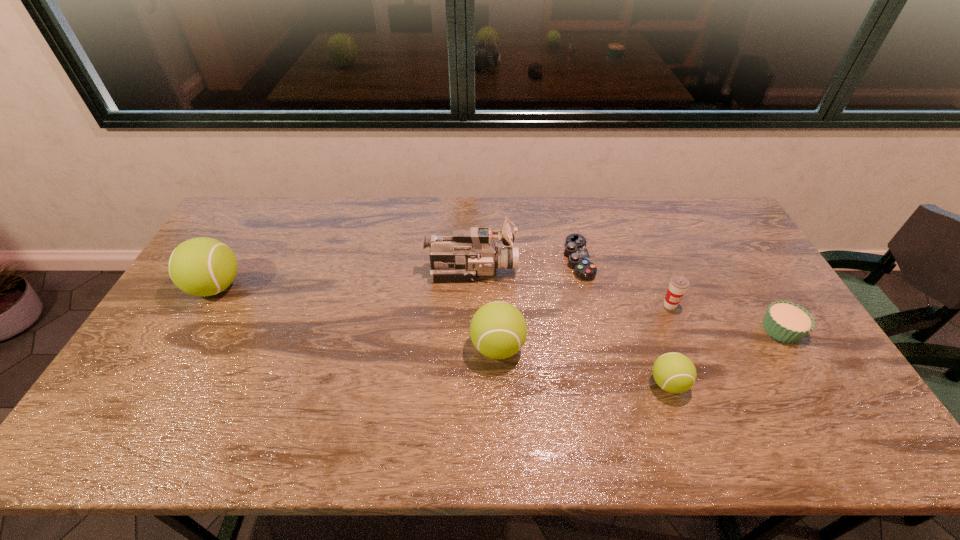
Find the location of `the farthest tennis ball`. the farthest tennis ball is located at coordinates (202, 266).

Where is `the leftmost object`? The height and width of the screenshot is (540, 960). the leftmost object is located at coordinates (202, 266).

This screenshot has width=960, height=540. I want to click on the second tennis ball from right to left, so click(x=498, y=330).

Identify the location of the third object from right to left. (674, 372).

This screenshot has width=960, height=540. Find the location of `the rightmost tennis ball`. the rightmost tennis ball is located at coordinates (674, 372).

At what (x,y) coordinates should I click in order to perform the action: click on camcorder. Please return your answer as a coordinate pair (x, y). Looking at the image, I should click on (470, 252).

This screenshot has height=540, width=960. I want to click on cupcake, so click(785, 321).

This screenshot has width=960, height=540. What are the coordinates of `the rightmost object` in the screenshot? It's located at (785, 321).

The width and height of the screenshot is (960, 540). Identify the location of cup. [x=678, y=284].

This screenshot has height=540, width=960. Identify the location of the fourth object from right to left. (579, 259).